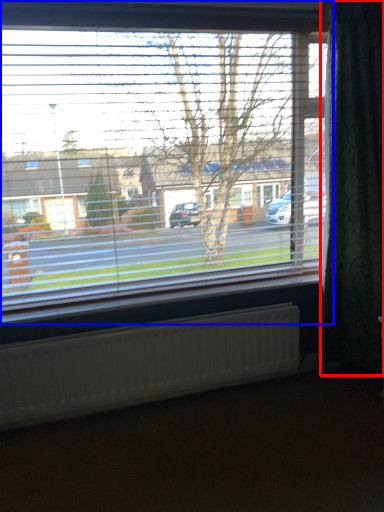
Question: Among these objects, which one is farthest to the camera, curtain (highlighted by a red box) or window (highlighted by a blue box)?

Choices:
 (A) curtain
 (B) window

Answer: (A)